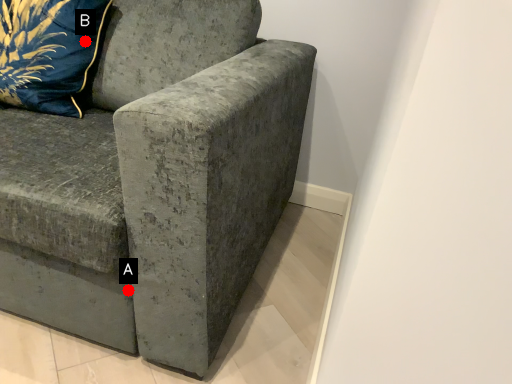
Question: Two points are circled on the image, labeled by A and B beside each circle. Which point is further to the camera?

Choices:
 (A) A is further
 (B) B is further

Answer: (B)